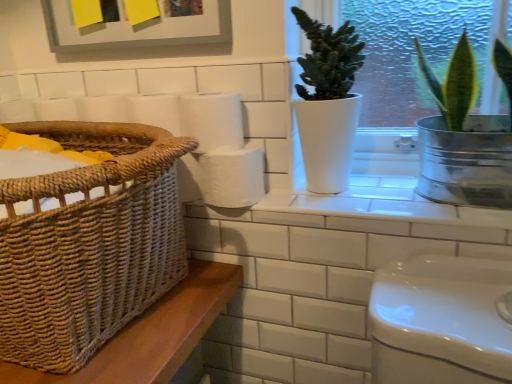
Image resolution: width=512 pixels, height=384 pixels. Identify the location of woven brown basket at left. (89, 244).

The width and height of the screenshot is (512, 384). I want to click on white ceramic window sill at upper center, so click(x=391, y=208).

Considering the sizes of objects woven brown basket at left and white matte paper towel at center in the image provided, who is smaller, woven brown basket at left or white matte paper towel at center?

Smaller between the two is white matte paper towel at center.

Is the depth of woven brown basket at left greater than that of white matte paper towel at center?

No, it is not.

Is woven brown basket at left completely or partially outside of white matte paper towel at center?

Yes, woven brown basket at left is not within white matte paper towel at center.

Considering the relative sizes of white ceramic window sill at upper center and white matte pot at center, the second houseplant positioned from the right, in the image provided, is white ceramic window sill at upper center taller than white matte pot at center, the second houseplant positioned from the right,?

Incorrect, the height of white ceramic window sill at upper center is not larger of that of white matte pot at center, the second houseplant positioned from the right.

You are a GUI agent. You are given a task and a screenshot of the screen. Output one action in this format:
    pyautogui.click(x=<x>, y=<y>)
    Task: Click on the window sill lying in front of the white matte pot at center, the 1th houseplant viewed from the left
    
    Given the screenshot: What is the action you would take?
    pyautogui.click(x=391, y=208)

Does point (312, 206) come behind point (354, 38)?

No, it is in front of (354, 38).

Is white ceramic window sill at upper center not inside white matte pot at center, the 1th houseplant viewed from the left?

Indeed, white ceramic window sill at upper center is completely outside white matte pot at center, the 1th houseplant viewed from the left.

Is there a large distance between metallic silver pot at upper right, which is counted as the second houseplant, starting from the left, and white matte pot at center, the 1th houseplant viewed from the left?

No, metallic silver pot at upper right, which is counted as the second houseplant, starting from the left, is not far away from white matte pot at center, the 1th houseplant viewed from the left.

Based on the photo, which of these two, metallic silver pot at upper right, which is the first houseplant in right-to-left order, or white matte pot at center, the second houseplant positioned from the right, stands taller?

Standing taller between the two is white matte pot at center, the second houseplant positioned from the right.

Does point (436, 95) come closer to viewer compared to point (330, 39)?

No, (436, 95) is further to viewer.

From the picture: Based on their sizes in the image, would you say metallic silver pot at upper right, which is counted as the second houseplant, starting from the left, is bigger or smaller than white matte pot at center, the second houseplant positioned from the right?

Considering their sizes, metallic silver pot at upper right, which is counted as the second houseplant, starting from the left, takes up more space than white matte pot at center, the second houseplant positioned from the right.

Who is smaller, white ceramic window sill at upper center or white matte paper towel at center?

white matte paper towel at center.

Is point (485, 226) less distant than point (195, 99)?

Yes, point (485, 226) is in front of point (195, 99).

Is white ceramic window sill at upper center facing away from white matte paper towel at center?

That's not correct — white ceramic window sill at upper center is not looking away from white matte paper towel at center.

Image resolution: width=512 pixels, height=384 pixels. What are the coordinates of `paper towel above the metallic silver pot at upper right, which is the first houseplant in right-to-left order (from a real-world perspective)` in the screenshot? It's located at (212, 121).

Is there a large distance between metallic silver pot at upper right, which is counted as the second houseplant, starting from the left, and white matte paper towel at center?

No, there isn't a large distance between metallic silver pot at upper right, which is counted as the second houseplant, starting from the left, and white matte paper towel at center.

Does white matte toilet paper at center have a smaller size compared to white matte pot at center, the 1th houseplant viewed from the left?

Yes.

In the image, is white matte toilet paper at center positioned in front of or behind white matte pot at center, the 1th houseplant viewed from the left?

white matte toilet paper at center is positioned farther from the viewer than white matte pot at center, the 1th houseplant viewed from the left.

Considering the sizes of white matte toilet paper at center and white matte pot at center, the 1th houseplant viewed from the left, in the image, is white matte toilet paper at center wider or thinner than white matte pot at center, the 1th houseplant viewed from the left,?

Considering their sizes, white matte toilet paper at center looks slimmer than white matte pot at center, the 1th houseplant viewed from the left.

Is white matte toilet paper at center taller than white matte pot at center, the second houseplant positioned from the right?

In fact, white matte toilet paper at center may be shorter than white matte pot at center, the second houseplant positioned from the right.

In the scene shown: Could you tell me if white matte paper towel at center is facing metallic silver pot at upper right, which is counted as the second houseplant, starting from the left?

No, white matte paper towel at center is not oriented towards metallic silver pot at upper right, which is counted as the second houseplant, starting from the left.

From a real-world perspective, is white matte paper towel at center located beneath metallic silver pot at upper right, which is the first houseplant in right-to-left order?

Actually, white matte paper towel at center is physically above metallic silver pot at upper right, which is the first houseplant in right-to-left order, in the real world.

In the scene shown: From the image's perspective, is white matte paper towel at center located beneath metallic silver pot at upper right, which is counted as the second houseplant, starting from the left?

No, from the image's perspective, white matte paper towel at center is not beneath metallic silver pot at upper right, which is counted as the second houseplant, starting from the left.

This screenshot has height=384, width=512. Identify the location of basket that appears in front of the white matte paper towel at center. (89, 244).

From a real-world perspective, which houseplant is the 2nd one above the white ceramic window sill at upper center? Please provide its 2D coordinates.

[(328, 103)]

Which object lies nearer to the anchor point white matte pot at center, the second houseplant positioned from the right, woven brown basket at left or white matte toilet paper at center?

white matte toilet paper at center is closer to white matte pot at center, the second houseplant positioned from the right.

Which object lies nearer to the anchor point white matte paper towel at center, white matte pot at center, the 1th houseplant viewed from the left, or white matte toilet paper at center?

white matte toilet paper at center is closer to white matte paper towel at center.

Based on their spatial positions, is metallic silver pot at upper right, which is the first houseplant in right-to-left order, or white matte paper towel at center closer to woven brown basket at left?

The object closer to woven brown basket at left is white matte paper towel at center.

Estimate the real-world distances between objects in this image. Which object is further from white matte paper towel at center, woven brown basket at left or white ceramic window sill at upper center?

Among the two, woven brown basket at left is located further to white matte paper towel at center.

From the image, which object appears to be nearer to white matte toilet paper at center, woven brown basket at left or metallic silver pot at upper right, which is the first houseplant in right-to-left order?

woven brown basket at left is closer to white matte toilet paper at center.

Considering their positions, is white matte toilet paper at center positioned further to white ceramic window sill at upper center than woven brown basket at left?

Among the two, woven brown basket at left is located further to white ceramic window sill at upper center.

When comparing their distances from white matte pot at center, the 1th houseplant viewed from the left, does metallic silver pot at upper right, which is the first houseplant in right-to-left order, or white matte toilet paper at center seem further?

The object further to white matte pot at center, the 1th houseplant viewed from the left, is metallic silver pot at upper right, which is the first houseplant in right-to-left order.

When comparing their distances from white matte pot at center, the second houseplant positioned from the right, does white matte paper towel at center or metallic silver pot at upper right, which is the first houseplant in right-to-left order, seem closer?

The object closer to white matte pot at center, the second houseplant positioned from the right, is white matte paper towel at center.

Find the location of `window sill between woven brown basket at left and metallic silver pot at upper right, which is counted as the second houseplant, starting from the left, in the horizontal direction`. window sill between woven brown basket at left and metallic silver pot at upper right, which is counted as the second houseplant, starting from the left, in the horizontal direction is located at coordinates (391, 208).

At what (x,y) coordinates should I click in order to perform the action: click on paper towel between woven brown basket at left and white ceramic window sill at upper center. Please return your answer as a coordinate pair (x, y). Looking at the image, I should click on (212, 121).

Where is `paper towel between woven brown basket at left and metallic silver pot at upper right, which is the first houseplant in right-to-left order, from left to right`? The height and width of the screenshot is (384, 512). paper towel between woven brown basket at left and metallic silver pot at upper right, which is the first houseplant in right-to-left order, from left to right is located at coordinates (212, 121).

Identify the location of toilet paper located between woven brown basket at left and white ceramic window sill at upper center in the left-right direction. (232, 176).